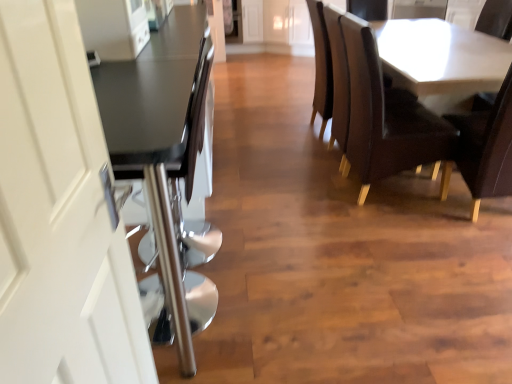
What do you see at coordinates (441, 60) in the screenshot? This screenshot has height=384, width=512. I see `white glossy table at upper right, which appears as the first table when viewed from the back` at bounding box center [441, 60].

The image size is (512, 384). I want to click on white glossy door handle at left, so click(x=59, y=215).

Is point (501, 105) positioned behind point (184, 315)?

Yes, point (501, 105) is behind point (184, 315).

From a real-world perspective, which object stands above the other?

In real-world perspective, matte black table at left, which appears as the 2th table when viewed from the back, is above.

Is matte black table at left, arranged as the first table when viewed from the front, completely or partially inside dark brown leather chair at right, which ranks as the 1th chair in right-to-left order?

Definitely not — matte black table at left, arranged as the first table when viewed from the front, is not inside dark brown leather chair at right, which ranks as the 1th chair in right-to-left order.

Is dark brown leather chair at right, the second chair in the left-to-right sequence, at the right side of matte black table at left, which appears as the 2th table when viewed from the back?

Yes.

Which is behind, white glossy table at upper right, which appears as the first table when viewed from the back, or matte black table at left, arranged as the first table when viewed from the front?

white glossy table at upper right, which appears as the first table when viewed from the back, is more distant.

Could you measure the distance between white glossy table at upper right, the first table from the right, and matte black table at left, arranged as the first table when viewed from the front?

white glossy table at upper right, the first table from the right, and matte black table at left, arranged as the first table when viewed from the front, are 4.84 feet apart.

Is white glossy table at upper right, the first table from the right, looking in the opposite direction of matte black table at left, arranged as the first table when viewed from the front?

No, white glossy table at upper right, the first table from the right, is not facing the opposite direction of matte black table at left, arranged as the first table when viewed from the front.

From the image's perspective, relative to dark brown leather chair at right, which ranks as the 1th chair in right-to-left order, is white glossy table at upper right, which appears as the first table when viewed from the back, above or below?

From the image's perspective, white glossy table at upper right, which appears as the first table when viewed from the back, appears above dark brown leather chair at right, which ranks as the 1th chair in right-to-left order.

Is white glossy table at upper right, the first table from the right, oriented towards dark brown leather chair at right, the second chair in the left-to-right sequence?

No, white glossy table at upper right, the first table from the right, is not facing towards dark brown leather chair at right, the second chair in the left-to-right sequence.

Considering the relative sizes of white glossy table at upper right, which appears as the first table when viewed from the back, and dark brown leather chair at right, the second chair in the left-to-right sequence, in the image provided, is white glossy table at upper right, which appears as the first table when viewed from the back, taller than dark brown leather chair at right, the second chair in the left-to-right sequence,?

No, white glossy table at upper right, which appears as the first table when viewed from the back, is not taller than dark brown leather chair at right, the second chair in the left-to-right sequence.

You are a GUI agent. You are given a task and a screenshot of the screen. Output one action in this format:
    pyautogui.click(x=<x>, y=<y>)
    Task: Click on the 2nd chair in front of the white glossy table at upper right, which is the 2th table in front-to-back order
    The width and height of the screenshot is (512, 384).
    Given the screenshot: What is the action you would take?
    pyautogui.click(x=486, y=148)

Which is more to the left, white glossy table at upper right, the first table from the right, or matte black countertop at left?

Positioned to the left is matte black countertop at left.

Can you confirm if white glossy table at upper right, which is the 2th table in front-to-back order, is bigger than matte black countertop at left?

Incorrect, white glossy table at upper right, which is the 2th table in front-to-back order, is not larger than matte black countertop at left.

Is the position of white glossy table at upper right, the first table from the right, less distant than that of matte black countertop at left?

No, white glossy table at upper right, the first table from the right, is further to the viewer.

Are white glossy table at upper right, the first table from the right, and matte black countertop at left making contact?

No, white glossy table at upper right, the first table from the right, is not next to matte black countertop at left.

Which of these two, leather armchair at center or leather seat at right, which is the first chair in left-to-right order, is smaller?

Smaller between the two is leather armchair at center.

Considering the relative sizes of leather armchair at center and leather seat at right, which ranks as the 2th chair in right-to-left order, in the image provided, is leather armchair at center wider than leather seat at right, which ranks as the 2th chair in right-to-left order,?

No, leather armchair at center is not wider than leather seat at right, which ranks as the 2th chair in right-to-left order.

How different are the orientations of leather armchair at center and leather seat at right, which ranks as the 2th chair in right-to-left order, in degrees?

The facing directions of leather armchair at center and leather seat at right, which ranks as the 2th chair in right-to-left order, are 8.88e-05 degrees apart.

Measure the distance between leather armchair at center and leather seat at right, which is the first chair in left-to-right order.

The distance of leather armchair at center from leather seat at right, which is the first chair in left-to-right order, is 11.46 inches.

Consider the image. Visually, is dark brown leather chair at right, the second chair in the left-to-right sequence, positioned to the left or to the right of white glossy table at upper right, which appears as the first table when viewed from the back?

Clearly, dark brown leather chair at right, the second chair in the left-to-right sequence, is on the right of white glossy table at upper right, which appears as the first table when viewed from the back, in the image.

In terms of size, does dark brown leather chair at right, the second chair in the left-to-right sequence, appear bigger or smaller than white glossy table at upper right, which is the 2th table in front-to-back order?

Considering their sizes, dark brown leather chair at right, the second chair in the left-to-right sequence, takes up less space than white glossy table at upper right, which is the 2th table in front-to-back order.

Does dark brown leather chair at right, which ranks as the 1th chair in right-to-left order, have a greater width compared to white glossy table at upper right, the 2th table from the left?

No.

Which is farther from the camera, (461, 124) or (392, 54)?

The point (392, 54) is farther from the camera.

From the image's perspective, between dark brown leather chair at right, which ranks as the 1th chair in right-to-left order, and leather seat at right, which ranks as the 2th chair in right-to-left order, who is located below?

dark brown leather chair at right, which ranks as the 1th chair in right-to-left order, is shown below in the image.

From a real-world perspective, who is located lower, dark brown leather chair at right, the second chair in the left-to-right sequence, or leather seat at right, which is the first chair in left-to-right order?

dark brown leather chair at right, the second chair in the left-to-right sequence, from a real-world perspective.

Is dark brown leather chair at right, the second chair in the left-to-right sequence, oriented towards leather seat at right, which is the first chair in left-to-right order?

No.

Can you confirm if dark brown leather chair at right, which ranks as the 1th chair in right-to-left order, is wider than leather seat at right, which ranks as the 2th chair in right-to-left order?

No.

At what (x,y) coordinates should I click in order to perform the action: click on table above the dark brown leather chair at right, which ranks as the 1th chair in right-to-left order (from a real-world perspective). Please return your answer as a coordinate pair (x, y). Looking at the image, I should click on (163, 157).

I want to click on table to the right of matte black table at left, the 2th table when ordered from right to left, so click(x=441, y=60).

Considering their positions, is white glossy door handle at left positioned closer to leather armchair at center than dark brown leather chair at right, the second chair in the left-to-right sequence?

dark brown leather chair at right, the second chair in the left-to-right sequence.

Estimate the real-world distances between objects in this image. Which object is closer to leather seat at right, which ranks as the 2th chair in right-to-left order, dark brown leather chair at right, the second chair in the left-to-right sequence, or white glossy table at upper right, which appears as the first table when viewed from the back?

Based on the image, dark brown leather chair at right, the second chair in the left-to-right sequence, appears to be nearer to leather seat at right, which ranks as the 2th chair in right-to-left order.

From the image, which object appears to be farther from white glossy door handle at left, leather armchair at center or leather seat at right, which is the first chair in left-to-right order?

leather armchair at center lies further to white glossy door handle at left than the other object.

Looking at the image, which one is located further to leather seat at right, which ranks as the 2th chair in right-to-left order, dark brown leather chair at right, the second chair in the left-to-right sequence, or leather armchair at center?

Among the two, dark brown leather chair at right, the second chair in the left-to-right sequence, is located further to leather seat at right, which ranks as the 2th chair in right-to-left order.

Which object lies nearer to the anchor point dark brown leather chair at right, the second chair in the left-to-right sequence, matte black countertop at left or leather armchair at center?

Based on the image, leather armchair at center appears to be nearer to dark brown leather chair at right, the second chair in the left-to-right sequence.

Estimate the real-world distances between objects in this image. Which object is further from leather seat at right, which ranks as the 2th chair in right-to-left order, white glossy door handle at left or dark brown leather chair at right, the second chair in the left-to-right sequence?

white glossy door handle at left lies further to leather seat at right, which ranks as the 2th chair in right-to-left order, than the other object.

Looking at the image, which one is located further to white glossy door handle at left, white glossy table at upper right, the 2th table from the left, or leather seat at right, which ranks as the 2th chair in right-to-left order?

white glossy table at upper right, the 2th table from the left, is further to white glossy door handle at left.

Estimate the real-world distances between objects in this image. Which object is further from leather armchair at center, matte black table at left, arranged as the first table when viewed from the front, or matte black countertop at left?

Based on the image, matte black table at left, arranged as the first table when viewed from the front, appears to be further to leather armchair at center.

This screenshot has height=384, width=512. I want to click on table between leather seat at right, which ranks as the 2th chair in right-to-left order, and dark brown leather chair at right, which ranks as the 1th chair in right-to-left order, in the horizontal direction, so click(x=441, y=60).

The height and width of the screenshot is (384, 512). What are the coordinates of `screen door between matte black table at left, the 2th table when ordered from right to left, and dark brown leather chair at right, the second chair in the left-to-right sequence, in the horizontal direction` in the screenshot? It's located at (59, 215).

Identify the location of chair between white glossy door handle at left and leather seat at right, which ranks as the 2th chair in right-to-left order, in the front-back direction. The width and height of the screenshot is (512, 384). (486, 148).

The height and width of the screenshot is (384, 512). I want to click on armchair between matte black countertop at left and leather seat at right, which ranks as the 2th chair in right-to-left order, from left to right, so click(339, 80).